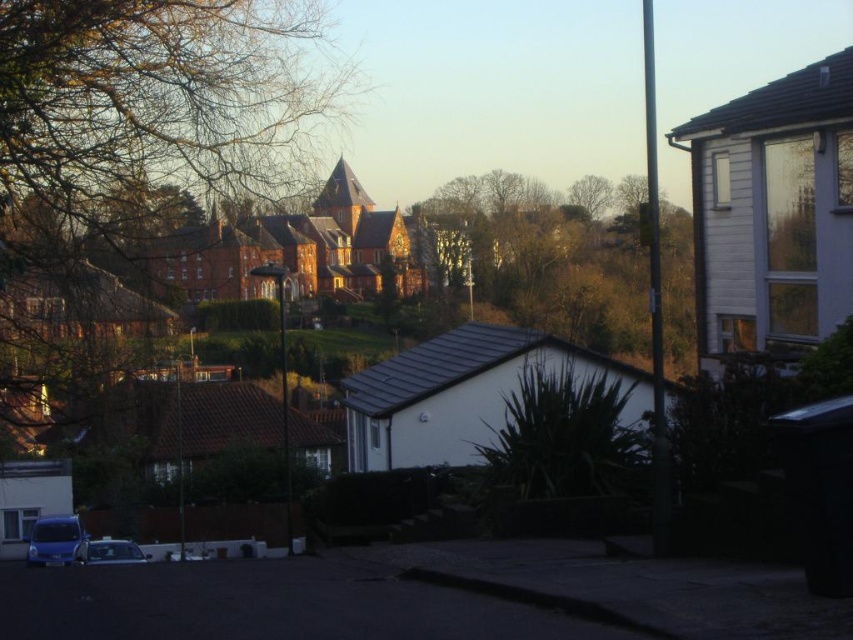
Question: Is the position of bare branches at upper left less distant than that of metallic blue van at lower left?

Choices:
 (A) no
 (B) yes

Answer: (B)

Question: Does bare branches at upper left appear over metallic blue van at lower left?

Choices:
 (A) no
 (B) yes

Answer: (B)

Question: Which point appears closest to the camera in this image?

Choices:
 (A) (531, 196)
 (B) (32, 563)

Answer: (B)

Question: Which object is closer to the camera taking this photo?

Choices:
 (A) metallic blue van at lower left
 (B) bare branches at upper left

Answer: (B)

Question: Which point is farther to the camera?

Choices:
 (A) green leafy tree at center
 (B) metallic blue van at lower left

Answer: (B)

Question: Can you confirm if bare branches at upper left is positioned below metallic blue van at lower left?

Choices:
 (A) yes
 (B) no

Answer: (B)